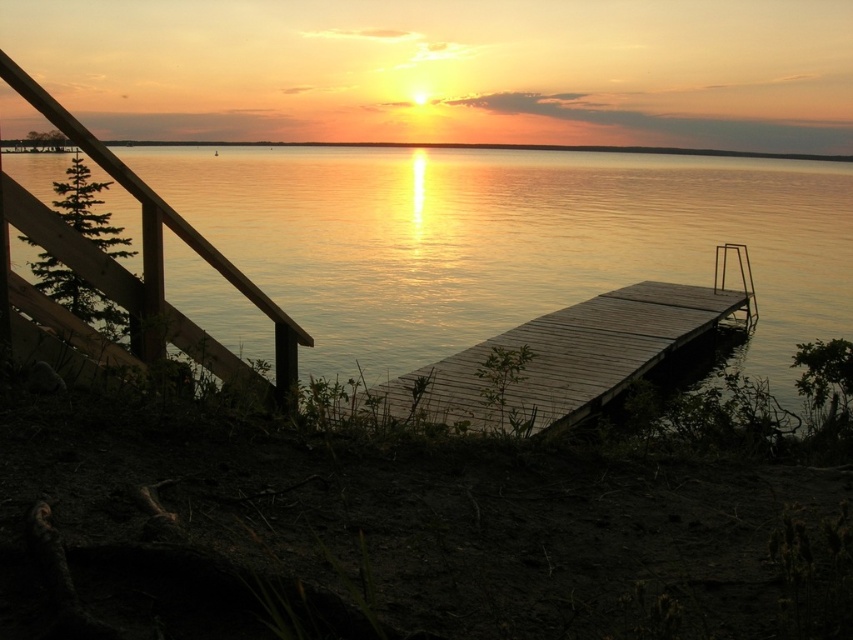
Who is shorter, glistening water at center or wooden rail at left?

With less height is wooden rail at left.

Between point (601, 164) and point (80, 243), which one is positioned in front?

Point (80, 243) is in front.

Who is more distant from viewer, (344, 353) or (4, 220)?

The point (344, 353) is more distant.

The height and width of the screenshot is (640, 853). I want to click on glistening water at center, so click(508, 241).

Can you confirm if glistening water at center is shorter than wooden at center?

In fact, glistening water at center may be taller than wooden at center.

You are a GUI agent. You are given a task and a screenshot of the screen. Output one action in this format:
    pyautogui.click(x=<x>, y=<y>)
    Task: Click on the glistening water at center
    The height and width of the screenshot is (640, 853).
    Given the screenshot: What is the action you would take?
    [508, 241]

Which is more to the right, wooden at center or wooden rail at left?

From the viewer's perspective, wooden at center appears more on the right side.

Identify the location of wooden at center. (566, 356).